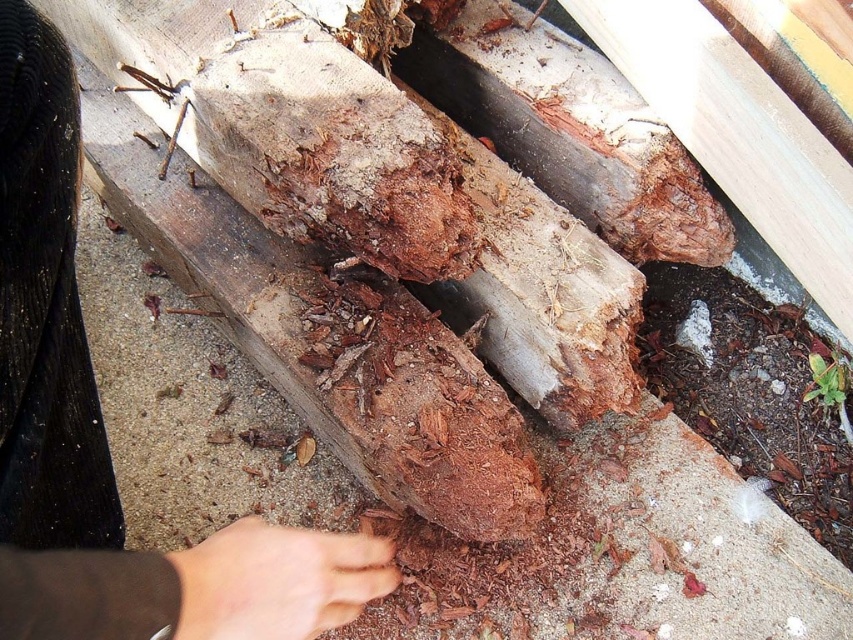
Does rusty wood plank at center have a lesser height compared to dry skin at lower center?

In fact, rusty wood plank at center may be taller than dry skin at lower center.

Is rusty wood plank at center positioned before dry skin at lower center?

No, rusty wood plank at center is behind dry skin at lower center.

I want to click on rusty wood plank at center, so click(x=737, y=132).

Can you confirm if brown leather hand at lower center is smaller than dry skin at lower center?

No.

Is brown leather hand at lower center thinner than dry skin at lower center?

No.

Between point (10, 481) and point (271, 637), which one is positioned in front?

Point (271, 637)

The width and height of the screenshot is (853, 640). What are the coordinates of `brown leather hand at lower center` in the screenshot? It's located at (103, 428).

Who is positioned more to the right, brown leather hand at lower center or rusty wood plank at center?

rusty wood plank at center

Who is taller, brown leather hand at lower center or rusty wood plank at center?

brown leather hand at lower center

Which is in front, point (4, 394) or point (836, 269)?

Point (4, 394)

Identify the location of brown leather hand at lower center. This screenshot has height=640, width=853. click(103, 428).